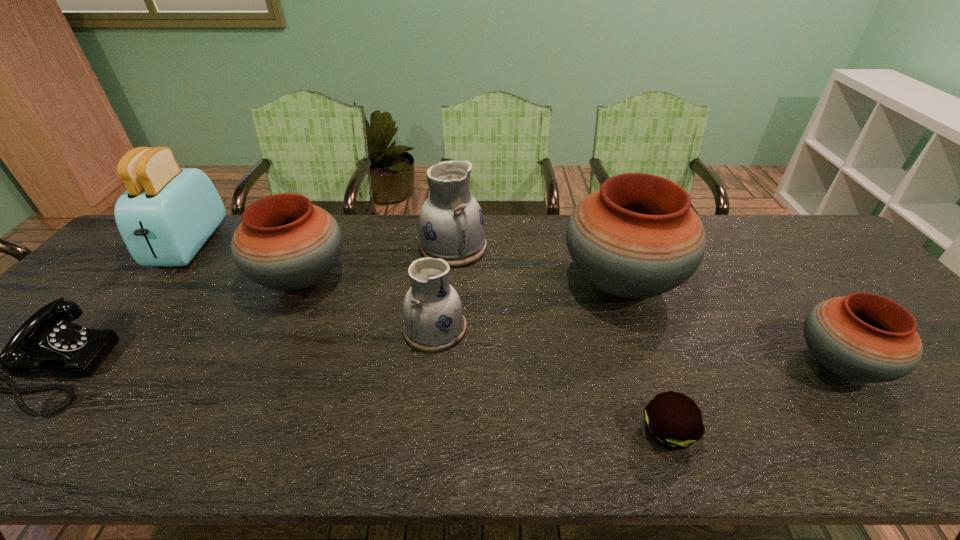
Locate an element on the screen. This screenshot has width=960, height=540. free spot between the farther blue pottery and the second red pottery from left to right is located at coordinates (538, 264).

The image size is (960, 540). I want to click on free point between the rightmost red pottery and the second smallest red pottery, so click(569, 321).

Identify the location of unoccupied position between the second red pottery from left to right and the sixth tallest object. (730, 323).

Where is `object that ranks as the seventh closest to the farther blue pottery`? This screenshot has width=960, height=540. object that ranks as the seventh closest to the farther blue pottery is located at coordinates (865, 337).

This screenshot has height=540, width=960. What are the coordinates of `object identified as the third closest to the rightmost pottery` in the screenshot? It's located at (451, 226).

Find the location of a particular element. This screenshot has width=960, height=540. pottery that is the third nearest to the light toaster is located at coordinates (433, 317).

Where is `pottery that stands as the second closest to the smaller blue pottery`? pottery that stands as the second closest to the smaller blue pottery is located at coordinates pos(284,242).

Locate which red pottery is the second closest to the third object from left to right. Please provide its 2D coordinates. Your answer should be formatted as a tuple, i.e. [(x, y)], where the tuple contains the x and y coordinates of a point satisfying the conditions above.

[(865, 337)]

Where is `the third closest red pottery relative to the light toaster`? The height and width of the screenshot is (540, 960). the third closest red pottery relative to the light toaster is located at coordinates (865, 337).

At what (x,y) coordinates should I click in order to perform the action: click on free region that satisfies the following two spatial constraints: 1. on the side of the rightmost pottery with the lever; 2. on the right side of the toaster. Please return your answer as a coordinate pair (x, y). This screenshot has height=540, width=960. Looking at the image, I should click on (89, 364).